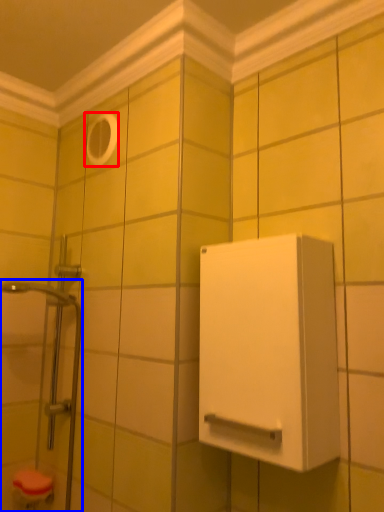
Question: Which point is further to the camera, hole (highlighted by a red box) or shower door (highlighted by a blue box)?

Choices:
 (A) hole
 (B) shower door

Answer: (A)